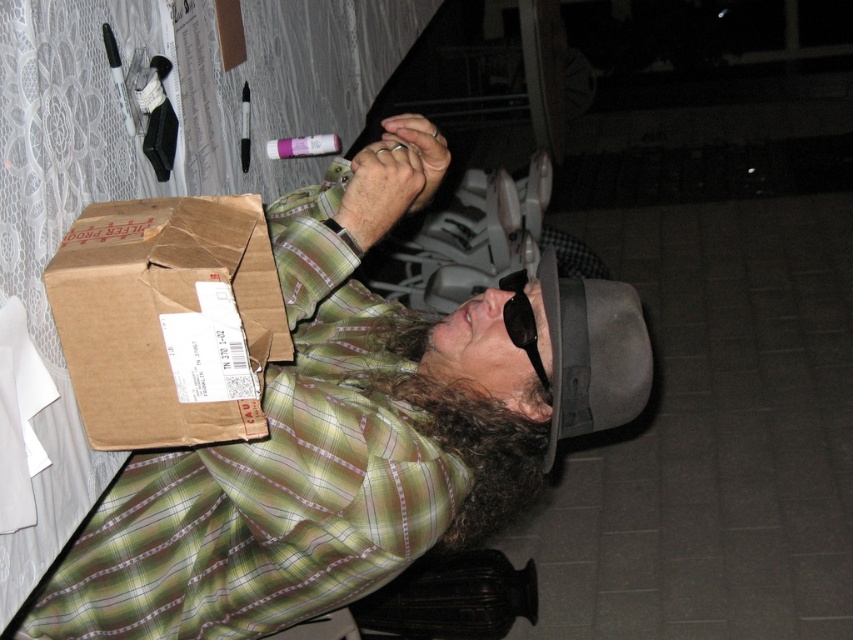
What do you see at coordinates (352, 429) in the screenshot? I see `brown cardboard box at center` at bounding box center [352, 429].

What are the coordinates of `brown cardboard box at center` in the screenshot? It's located at (352, 429).